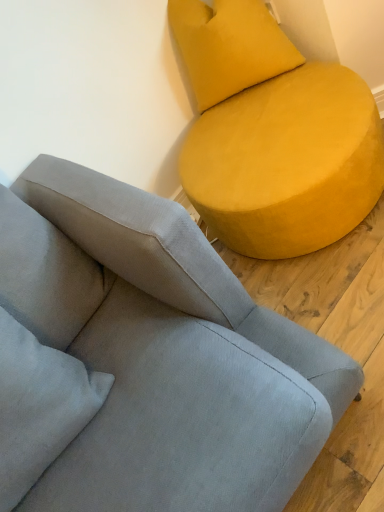
Identify the location of velvet yellow pillow at upper right. This screenshot has width=384, height=512. (227, 47).

In order to click on suede gray couch at upper right, which appears as the first studio couch when viewed from the left in this screenshot , I will do `click(145, 360)`.

Is suede gray couch at upper right, which appears as the first studio couch when viewed from the left, in front of matte yellow ottoman at upper right, the 1th studio couch when ordered from right to left?

Yes, suede gray couch at upper right, which appears as the first studio couch when viewed from the left, is closer to the viewer.

Considering the relative sizes of suede gray couch at upper right, which is counted as the 2th studio couch, starting from the right, and matte yellow ottoman at upper right, acting as the 2th studio couch starting from the left, in the image provided, is suede gray couch at upper right, which is counted as the 2th studio couch, starting from the right, bigger than matte yellow ottoman at upper right, acting as the 2th studio couch starting from the left,?

Yes, suede gray couch at upper right, which is counted as the 2th studio couch, starting from the right, is bigger than matte yellow ottoman at upper right, acting as the 2th studio couch starting from the left.

From a real-world perspective, is suede gray couch at upper right, which appears as the first studio couch when viewed from the left, positioned over matte yellow ottoman at upper right, acting as the 2th studio couch starting from the left, based on gravity?

Yes.

Is suede gray couch at upper right, which is counted as the 2th studio couch, starting from the right, not close to matte yellow ottoman at upper right, the 1th studio couch when ordered from right to left?

suede gray couch at upper right, which is counted as the 2th studio couch, starting from the right, is actually quite close to matte yellow ottoman at upper right, the 1th studio couch when ordered from right to left.

Is suede gray couch at upper right, which is counted as the 2th studio couch, starting from the right, completely or partially inside velvet yellow pillow at upper right?

No, suede gray couch at upper right, which is counted as the 2th studio couch, starting from the right, is not inside velvet yellow pillow at upper right.

From the image's perspective, is velvet yellow pillow at upper right positioned above or below suede gray couch at upper right, which appears as the first studio couch when viewed from the left?

Clearly, from the image's perspective, velvet yellow pillow at upper right is above suede gray couch at upper right, which appears as the first studio couch when viewed from the left.

From the picture: Is velvet yellow pillow at upper right not close to suede gray couch at upper right, which is counted as the 2th studio couch, starting from the right?

No, velvet yellow pillow at upper right is in close proximity to suede gray couch at upper right, which is counted as the 2th studio couch, starting from the right.

Is velvet yellow pillow at upper right located outside matte yellow ottoman at upper right, the 1th studio couch when ordered from right to left?

Yes, velvet yellow pillow at upper right is outside of matte yellow ottoman at upper right, the 1th studio couch when ordered from right to left.

Can you tell me how much velvet yellow pillow at upper right and matte yellow ottoman at upper right, the 1th studio couch when ordered from right to left, differ in facing direction?

velvet yellow pillow at upper right and matte yellow ottoman at upper right, the 1th studio couch when ordered from right to left, are facing 89.5 degrees away from each other.

Is velvet yellow pillow at upper right bigger or smaller than matte yellow ottoman at upper right, the 1th studio couch when ordered from right to left?

In the image, velvet yellow pillow at upper right appears to be smaller than matte yellow ottoman at upper right, the 1th studio couch when ordered from right to left.

From a real-world perspective, is velvet yellow pillow at upper right beneath matte yellow ottoman at upper right, acting as the 2th studio couch starting from the left?

No, from a real-world perspective, velvet yellow pillow at upper right is not below matte yellow ottoman at upper right, acting as the 2th studio couch starting from the left.

Does matte yellow ottoman at upper right, acting as the 2th studio couch starting from the left, have a lesser height compared to velvet yellow pillow at upper right?

Indeed, matte yellow ottoman at upper right, acting as the 2th studio couch starting from the left, has a lesser height compared to velvet yellow pillow at upper right.

Is matte yellow ottoman at upper right, the 1th studio couch when ordered from right to left, positioned with its back to velvet yellow pillow at upper right?

No, matte yellow ottoman at upper right, the 1th studio couch when ordered from right to left, is not facing the opposite direction of velvet yellow pillow at upper right.

Which object is positioned more to the right, matte yellow ottoman at upper right, acting as the 2th studio couch starting from the left, or velvet yellow pillow at upper right?

matte yellow ottoman at upper right, acting as the 2th studio couch starting from the left, is more to the right.

Which of these two, matte yellow ottoman at upper right, the 1th studio couch when ordered from right to left, or velvet yellow pillow at upper right, is smaller?

velvet yellow pillow at upper right.

Considering their positions, is suede gray couch at upper right, which is counted as the 2th studio couch, starting from the right, located in front of or behind velvet yellow pillow at upper right?

Clearly, suede gray couch at upper right, which is counted as the 2th studio couch, starting from the right, is in front of velvet yellow pillow at upper right.

Between point (120, 408) and point (261, 23), which one is positioned in front?

Point (120, 408)

Measure the distance from suede gray couch at upper right, which is counted as the 2th studio couch, starting from the right, to velvet yellow pillow at upper right.

They are 34.10 inches apart.

Considering the positions of point (352, 132) and point (287, 419), is point (352, 132) closer or farther from the camera than point (287, 419)?

Point (352, 132).

Locate an element on the screen. The image size is (384, 512). studio couch located underneath the suede gray couch at upper right, which appears as the first studio couch when viewed from the left (from a real-world perspective) is located at coordinates (272, 133).

How distant is matte yellow ottoman at upper right, acting as the 2th studio couch starting from the left, from suede gray couch at upper right, which appears as the first studio couch when viewed from the left?

21.27 inches.

Is suede gray couch at upper right, which appears as the first studio couch when viewed from the left, inside matte yellow ottoman at upper right, the 1th studio couch when ordered from right to left?

No, suede gray couch at upper right, which appears as the first studio couch when viewed from the left, is not surrounded by matte yellow ottoman at upper right, the 1th studio couch when ordered from right to left.

This screenshot has height=512, width=384. I want to click on studio couch below the matte yellow ottoman at upper right, the 1th studio couch when ordered from right to left (from the image's perspective), so click(145, 360).

At what (x,y) coordinates should I click in order to perform the action: click on studio couch that appears on the left of velvet yellow pillow at upper right. Please return your answer as a coordinate pair (x, y). This screenshot has width=384, height=512. Looking at the image, I should click on (145, 360).

Estimate the real-world distances between objects in this image. Which object is further from matte yellow ottoman at upper right, the 1th studio couch when ordered from right to left, suede gray couch at upper right, which appears as the first studio couch when viewed from the left, or velvet yellow pillow at upper right?

Based on the image, suede gray couch at upper right, which appears as the first studio couch when viewed from the left, appears to be further to matte yellow ottoman at upper right, the 1th studio couch when ordered from right to left.

When comparing their distances from suede gray couch at upper right, which appears as the first studio couch when viewed from the left, does matte yellow ottoman at upper right, the 1th studio couch when ordered from right to left, or velvet yellow pillow at upper right seem further?

The object further to suede gray couch at upper right, which appears as the first studio couch when viewed from the left, is velvet yellow pillow at upper right.

Looking at this image, based on their spatial positions, is velvet yellow pillow at upper right or suede gray couch at upper right, which appears as the first studio couch when viewed from the left, further from matte yellow ottoman at upper right, the 1th studio couch when ordered from right to left?

suede gray couch at upper right, which appears as the first studio couch when viewed from the left, is further to matte yellow ottoman at upper right, the 1th studio couch when ordered from right to left.

Considering their positions, is matte yellow ottoman at upper right, the 1th studio couch when ordered from right to left, positioned closer to velvet yellow pillow at upper right than suede gray couch at upper right, which is counted as the 2th studio couch, starting from the right?

Among the two, matte yellow ottoman at upper right, the 1th studio couch when ordered from right to left, is located nearer to velvet yellow pillow at upper right.

Looking at this image, estimate the real-world distances between objects in this image. Which object is closer to velvet yellow pillow at upper right, suede gray couch at upper right, which is counted as the 2th studio couch, starting from the right, or matte yellow ottoman at upper right, acting as the 2th studio couch starting from the left?

matte yellow ottoman at upper right, acting as the 2th studio couch starting from the left.

Based on their spatial positions, is velvet yellow pillow at upper right or matte yellow ottoman at upper right, the 1th studio couch when ordered from right to left, closer to suede gray couch at upper right, which appears as the first studio couch when viewed from the left?

matte yellow ottoman at upper right, the 1th studio couch when ordered from right to left, is closer to suede gray couch at upper right, which appears as the first studio couch when viewed from the left.

You are a GUI agent. You are given a task and a screenshot of the screen. Output one action in this format:
    pyautogui.click(x=<x>, y=<y>)
    Task: Click on the studio couch between suede gray couch at upper right, which appears as the first studio couch when viewed from the left, and velvet yellow pillow at upper right, along the z-axis
    
    Given the screenshot: What is the action you would take?
    pyautogui.click(x=272, y=133)